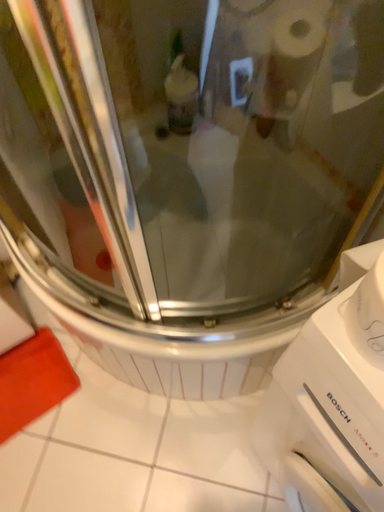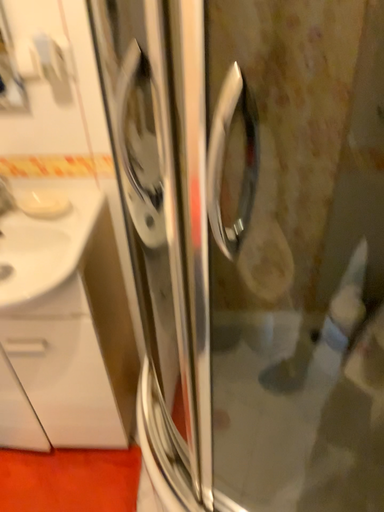
Question: How did the camera likely rotate when shooting the video?

Choices:
 (A) rotated left
 (B) rotated right

Answer: (A)